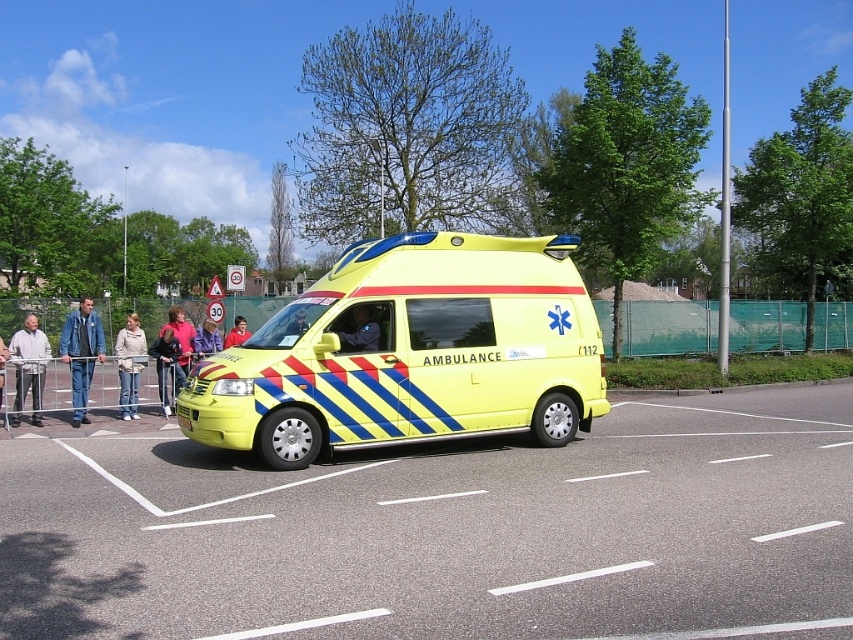
Question: Based on their relative distances, which object is farther from the jeans at center?

Choices:
 (A) yellow matte ambulance at center
 (B) red fabric shirt at center

Answer: (A)

Question: Does matte yellow helmet at center have a greater width compared to jeans at center?

Choices:
 (A) yes
 (B) no

Answer: (B)

Question: Does dark blue jeans at center appear on the right side of jeans at center?

Choices:
 (A) yes
 (B) no

Answer: (A)

Question: From the image, what is the correct spatial relationship of light beige sweater at center in relation to denim jacket at center?

Choices:
 (A) below
 (B) above

Answer: (A)

Question: Which point is closer to the camera?

Choices:
 (A) (202, 326)
 (B) (368, 349)

Answer: (B)

Question: Which point is closer to the camera?

Choices:
 (A) (297, 310)
 (B) (210, 324)

Answer: (A)